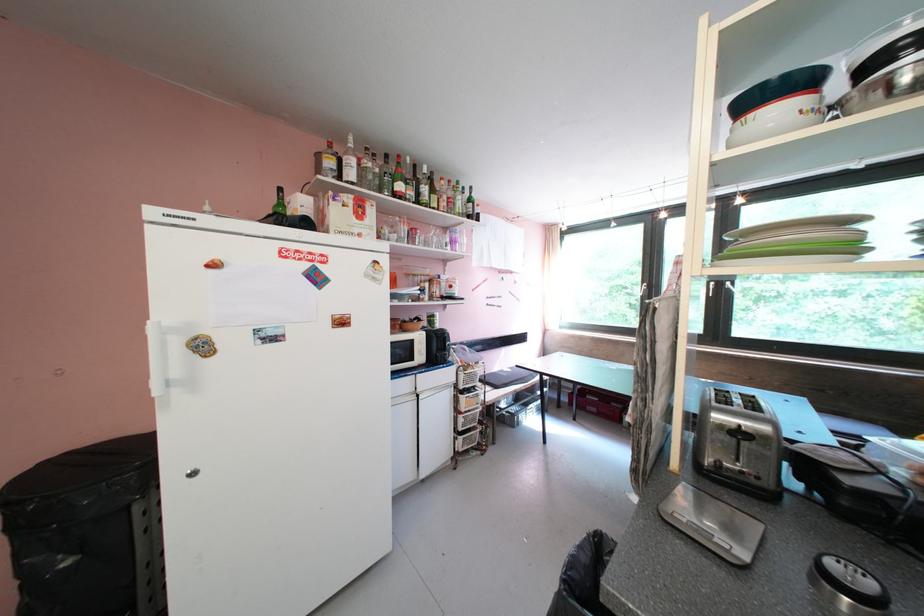
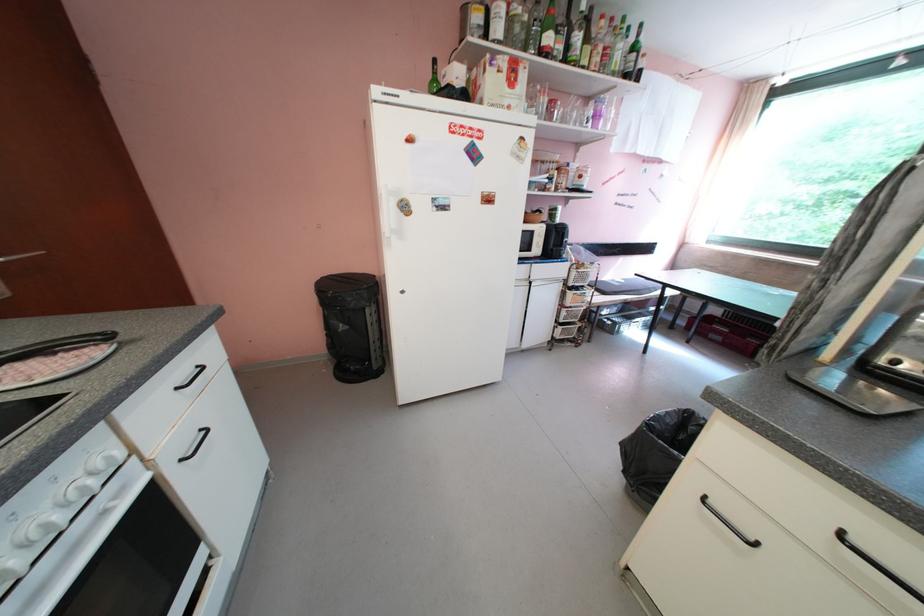
First-person continuous shooting, in which direction is the camera rotating?

The camera's rotation is toward left-down.